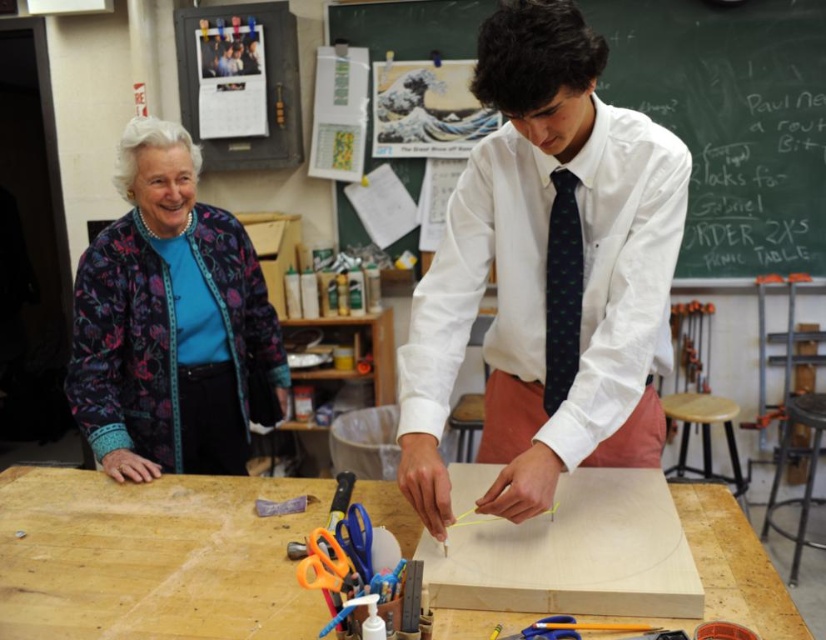
Does floral-patterned fabric at left have a larger size compared to dark green textured tie at center?

Correct, floral-patterned fabric at left is larger in size than dark green textured tie at center.

This screenshot has width=826, height=640. I want to click on floral-patterned fabric at left, so click(x=169, y=321).

Who is more distant from viewer, (247,291) or (556,326)?

The point (247,291) is behind.

The image size is (826, 640). What are the coordinates of `floral-patterned fabric at left` in the screenshot? It's located at point(169,321).

Who is more forward, (74, 596) or (720, 420)?

Point (74, 596) is in front.

Is light brown wood at center to the left of wooden stool at right from the viewer's perspective?

Correct, you'll find light brown wood at center to the left of wooden stool at right.

Does point (179, 509) come behind point (708, 419)?

That is False.

You are a GUI agent. You are given a task and a screenshot of the screen. Output one action in this format:
    pyautogui.click(x=<x>, y=<y>)
    Task: Click on the light brown wood at center
    This screenshot has width=826, height=640.
    Given the screenshot: What is the action you would take?
    pyautogui.click(x=150, y=557)

Can you confirm if green chalkboard at upper center is wider than wooden stool at right?

Indeed, green chalkboard at upper center has a greater width compared to wooden stool at right.

Between green chalkboard at upper center and wooden stool at right, which one is positioned lower?

Positioned lower is wooden stool at right.

What do you see at coordinates (730, 120) in the screenshot? Image resolution: width=826 pixels, height=640 pixels. I see `green chalkboard at upper center` at bounding box center [730, 120].

Where is `green chalkboard at upper center`? green chalkboard at upper center is located at coordinates (730, 120).